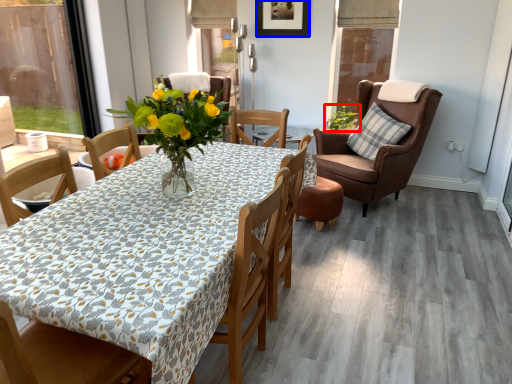
Question: Which point is closer to the camera, houseplant (highlighted by a red box) or picture frame (highlighted by a blue box)?

Choices:
 (A) houseplant
 (B) picture frame

Answer: (B)